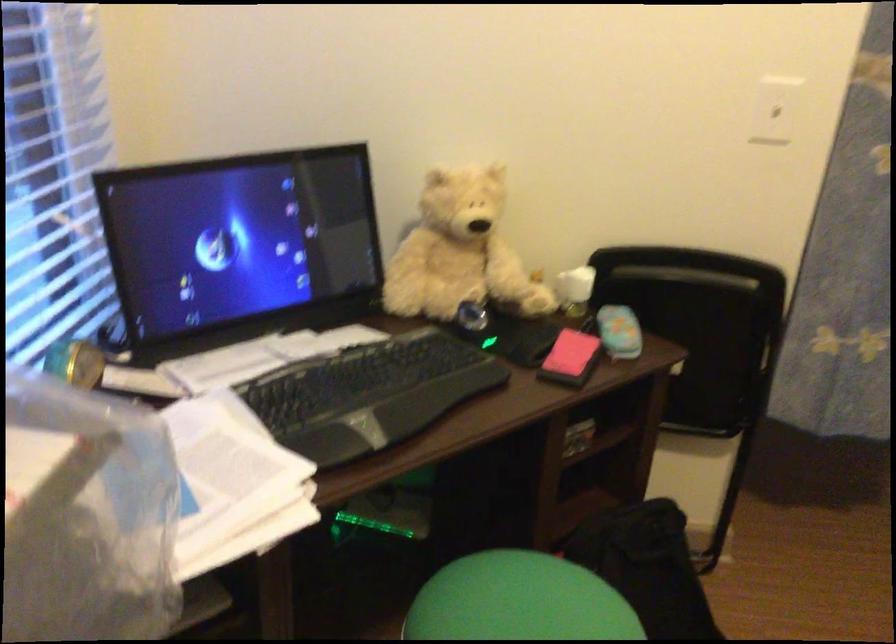
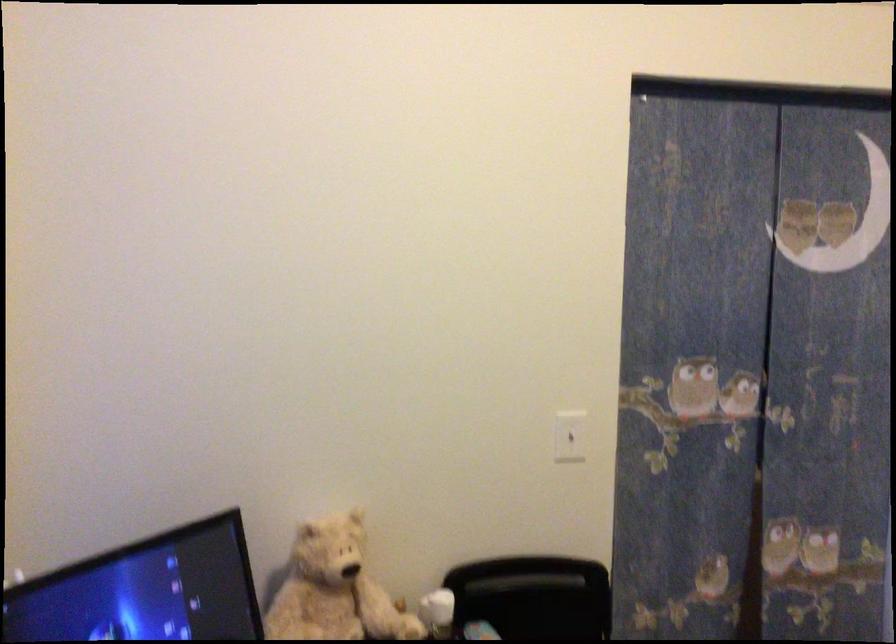
Where in the second image is the point corresponding to point (778, 102) from the first image?

(570, 436)